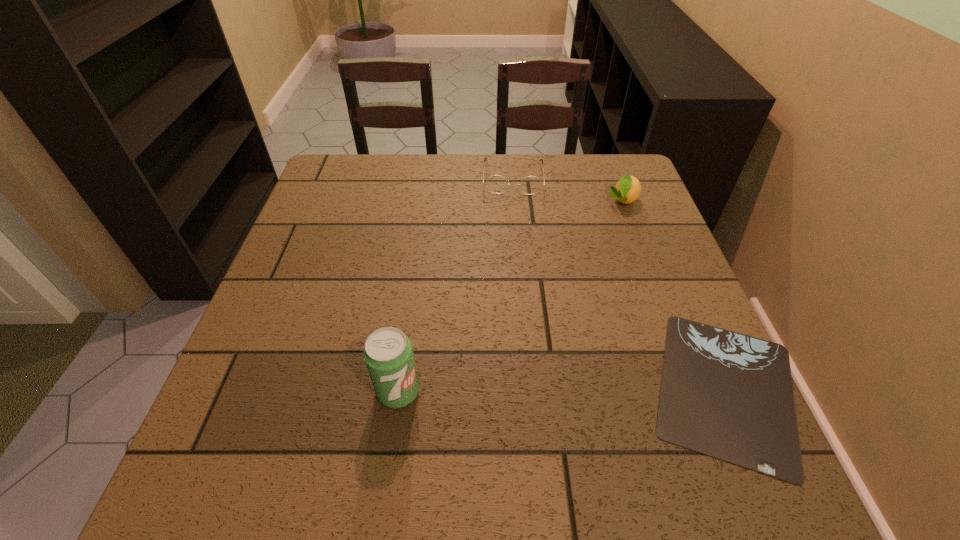
At what (x,y) coordinates should I click in order to perform the action: click on vacant area between the third tallest object and the lemon. Please return your answer as a coordinate pair (x, y). This screenshot has height=540, width=960. Looking at the image, I should click on (567, 190).

Identify the location of vacant space that is in between the second tallest object and the tallest object. [511, 296].

The width and height of the screenshot is (960, 540). I want to click on unoccupied position between the third shortest object and the third object from right to left, so click(567, 190).

Where is `empty location between the third shortest object and the tallest object`? empty location between the third shortest object and the tallest object is located at coordinates (511, 296).

Image resolution: width=960 pixels, height=540 pixels. Find the location of `vacant point located between the shortest object and the leftmost object`. vacant point located between the shortest object and the leftmost object is located at coordinates (563, 390).

You are a GUI agent. You are given a task and a screenshot of the screen. Output one action in this format:
    pyautogui.click(x=<x>, y=<y>)
    Task: Click on the vacant area between the leftmost object and the spectacles
    
    Given the screenshot: What is the action you would take?
    pyautogui.click(x=456, y=285)

This screenshot has height=540, width=960. What are the coordinates of `free point between the spectacles and the soda` in the screenshot? It's located at (456, 285).

Where is `vacant space that is in between the third shortest object and the spectacles`? The width and height of the screenshot is (960, 540). vacant space that is in between the third shortest object and the spectacles is located at coordinates (567, 190).

Choose which object is the nearest neighbor to the lemon. Please provide its 2D coordinates. Your answer should be formatted as a tuple, i.e. [(x, y)], where the tuple contains the x and y coordinates of a point satisfying the conditions above.

[(497, 184)]

Locate which object ranks second in proximity to the mousepad. Please provide its 2D coordinates. Your answer should be formatted as a tuple, i.e. [(x, y)], where the tuple contains the x and y coordinates of a point satisfying the conditions above.

[(388, 354)]